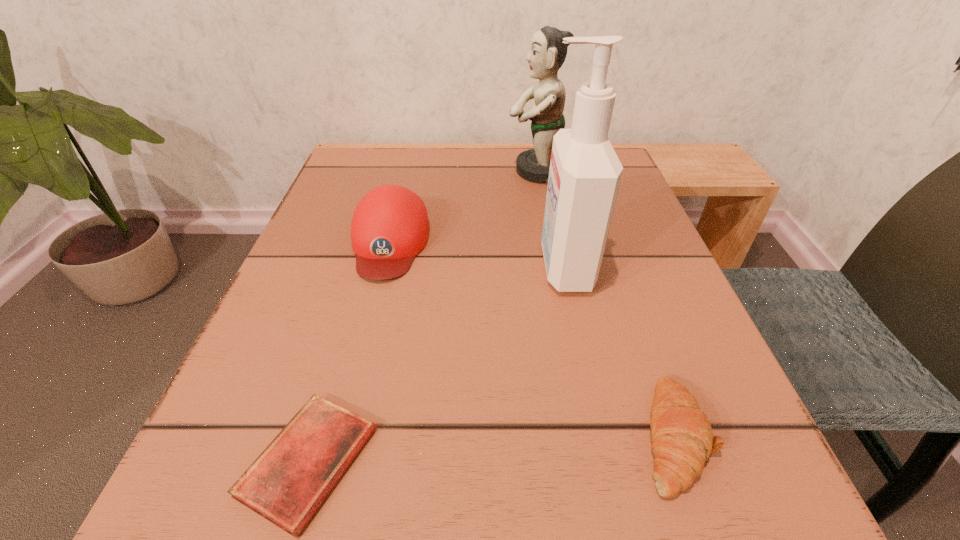
Locate an element on the screen. The width and height of the screenshot is (960, 540). free point located 0.290m on the front-facing side of the farthest object is located at coordinates (375, 171).

Image resolution: width=960 pixels, height=540 pixels. I want to click on vacant space situated on the front-facing side of the farthest object, so click(389, 171).

The width and height of the screenshot is (960, 540). Identify the location of vacant space located 0.250m on the front-facing side of the third tallest object. (343, 430).

Find the location of a particular element. Image resolution: width=960 pixels, height=540 pixels. vacant space situated 0.360m on the back of the crescent roll is located at coordinates (599, 221).

In order to click on free space located on the back of the shortest object in this screenshot , I will do `click(372, 245)`.

You are a GUI agent. You are given a task and a screenshot of the screen. Output one action in this format:
    pyautogui.click(x=<x>, y=<y>)
    Task: Click on the object present at the far edge
    The image size is (960, 540).
    Given the screenshot: What is the action you would take?
    pyautogui.click(x=547, y=54)

Find the location of a particular element. crescent roll present at the near edge is located at coordinates (682, 438).

Find the location of a particular element. This screenshot has width=960, height=540. diary located at the near edge is located at coordinates tap(287, 483).

Where is `baseball cap that is at the left edge`? The width and height of the screenshot is (960, 540). baseball cap that is at the left edge is located at coordinates (390, 226).

Locate an element on the screen. This screenshot has width=960, height=540. diary located at the left edge is located at coordinates (287, 483).